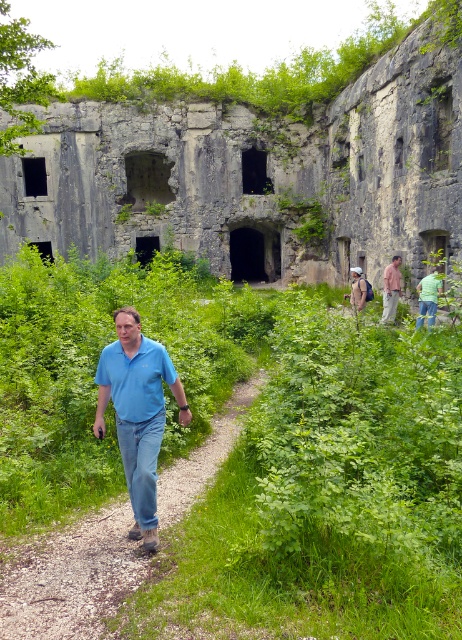
Question: Does gray stone ruins at center appear on the left side of light blue shirt at center?

Choices:
 (A) no
 (B) yes

Answer: (B)

Question: Which point is closer to the camera?

Choices:
 (A) green leafy vegetation at center
 (B) gray stone ruins at center
 (C) blue denim jeans at center
 (D) pink fabric shirt at center

Answer: (A)

Question: Which point is closer to the camera taking this photo?

Choices:
 (A) (363, 285)
 (B) (432, 269)

Answer: (B)

Question: Does blue denim jeans at center lie in front of light blue shirt at center?

Choices:
 (A) no
 (B) yes

Answer: (B)

Question: Can you confirm if green grassy path at center is bigger than green matte shirt at center?

Choices:
 (A) no
 (B) yes

Answer: (A)

Question: Which point is farther to the camera?

Choices:
 (A) light blue shirt at center
 (B) green leafy vegetation at center

Answer: (A)